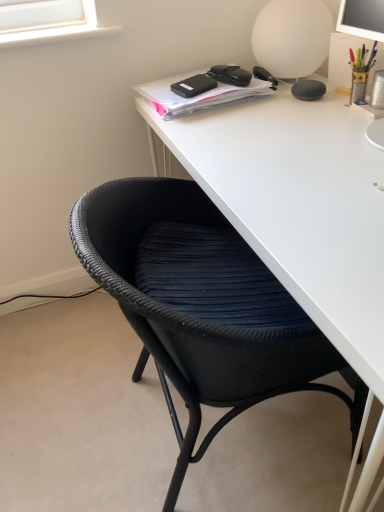
The height and width of the screenshot is (512, 384). What are the coordinates of `free space that is in between matte black speaker at upper right, which is the second stationery from right to left, and black matte hard drive at upper center, placed as the first stationery when sorted from left to right` in the screenshot? It's located at (254, 102).